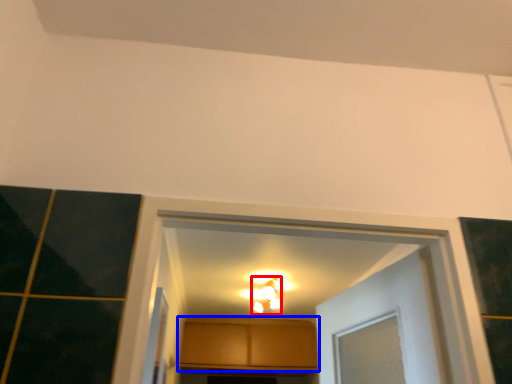
Question: Which object appears farthest to the camera in this image, light fixture (highlighted by a red box) or cabinetry (highlighted by a blue box)?

Choices:
 (A) light fixture
 (B) cabinetry

Answer: (B)